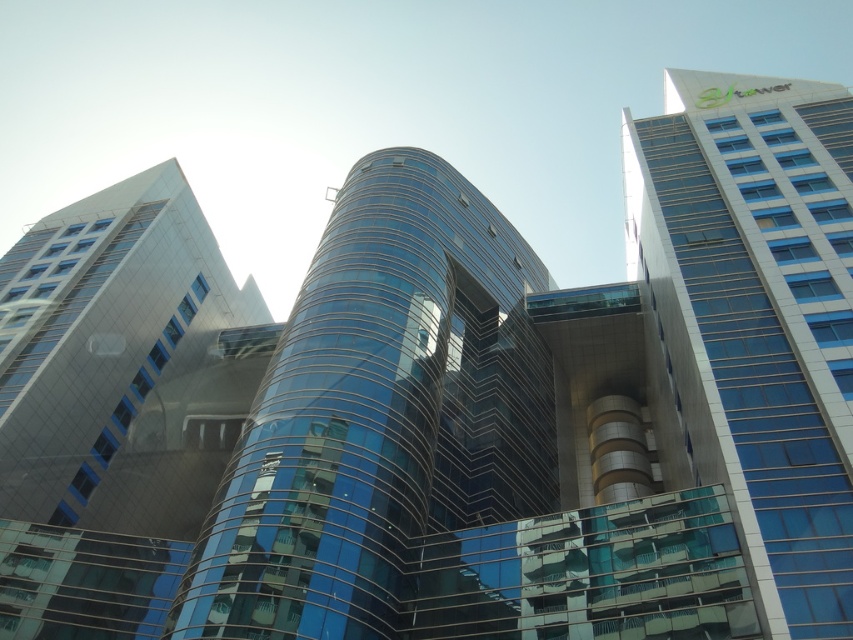
You are standing in the urban scene and want to determine the relative depth of two points marked in the image. Which point is closer to you, point at coordinate (538, 428) or point at coordinate (50, 483)?

Point at coordinate (538, 428) is further to the viewer than point at coordinate (50, 483), so the point at coordinate (50, 483) is closer to you.

You are standing at the origin point in the urban scene. Where is the shiny glass tower at center located in terms of coordinates?

The shiny glass tower at center is located at coordinates point (380, 413).

Consider the image. You are an urban planner reviewing this architectural design. You need to determine the spatial relationship between the shiny glass tower at center and the blue glass building at upper right. Based on the scene, which of these two structures is positioned lower in the image?

The shiny glass tower at center is located below the blue glass building at upper right, so the shiny glass tower at center is positioned lower in the image.